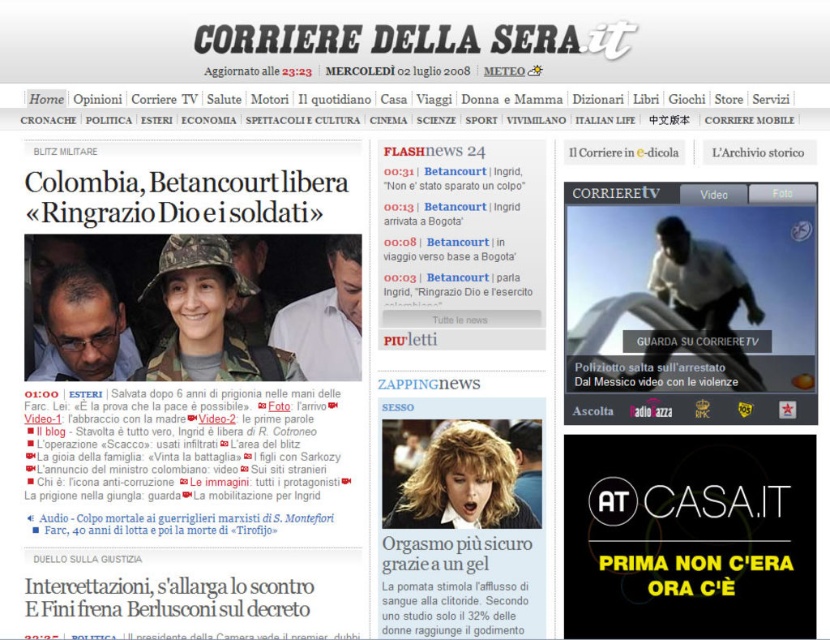
Between camouflage fabric hat at center and dark skin/rough fabric person at right, which one is positioned lower?

camouflage fabric hat at center

What do you see at coordinates (208, 316) in the screenshot? I see `camouflage fabric hat at center` at bounding box center [208, 316].

Describe the element at coordinates (208, 316) in the screenshot. I see `camouflage fabric hat at center` at that location.

I want to click on camouflage fabric hat at center, so click(208, 316).

Is camouflage fabric hat at center wider than blonde hair at center?

Yes.

Is camouflage fabric hat at center to the left of blonde hair at center from the viewer's perspective?

Correct, you'll find camouflage fabric hat at center to the left of blonde hair at center.

At what (x,y) coordinates should I click in order to perform the action: click on camouflage fabric hat at center. Please return your answer as a coordinate pair (x, y). Looking at the image, I should click on (208, 316).

Which is more to the right, blonde hair at center or dark brown hair at left?

blonde hair at center is more to the right.

Consider the image. Does blonde hair at center have a greater height compared to dark brown hair at left?

No, blonde hair at center is not taller than dark brown hair at left.

Does point (396, 509) lie behind point (128, 372)?

No, it is not.

The image size is (830, 640). I want to click on blonde hair at center, so click(462, 483).